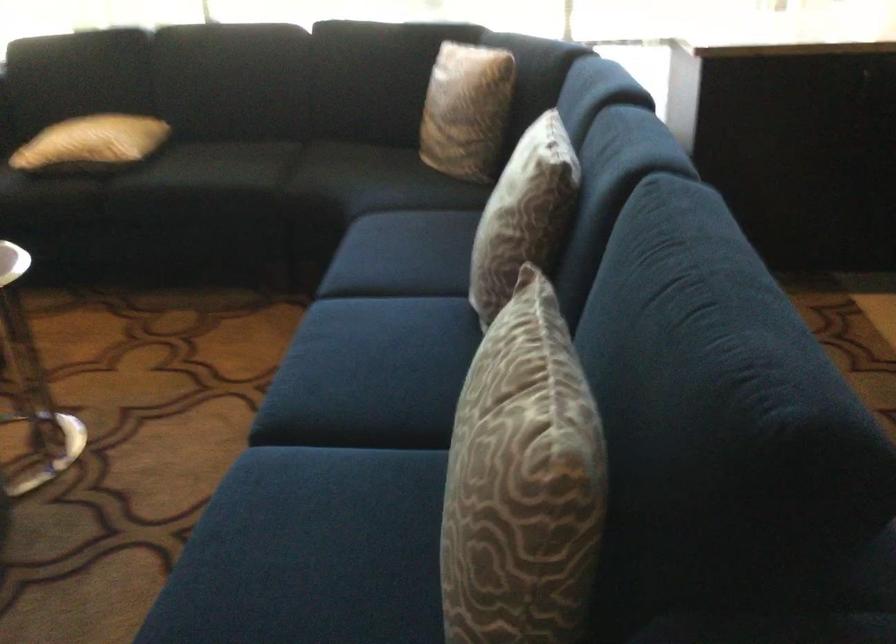
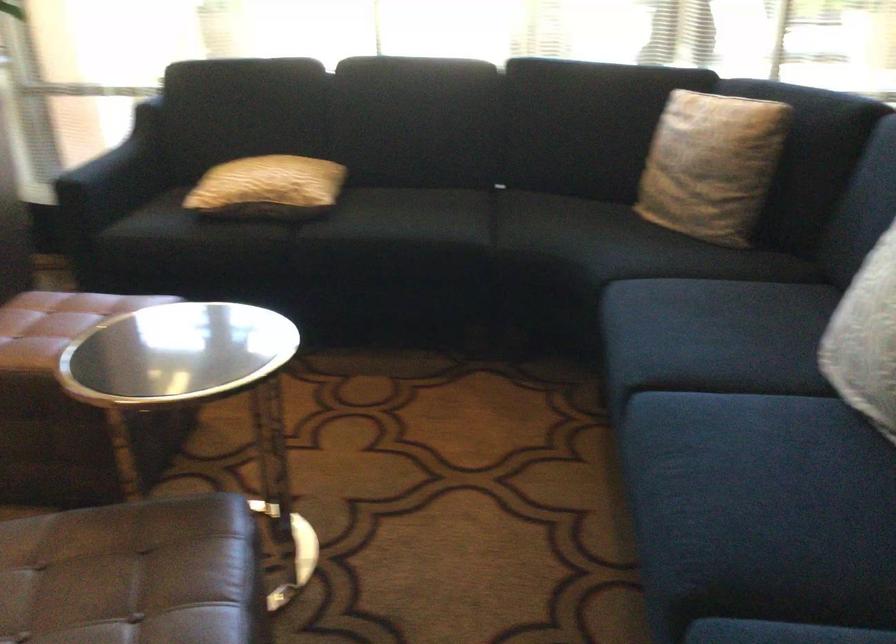
In the second image, find the point that corresponds to point (358, 346) in the first image.

(745, 459)